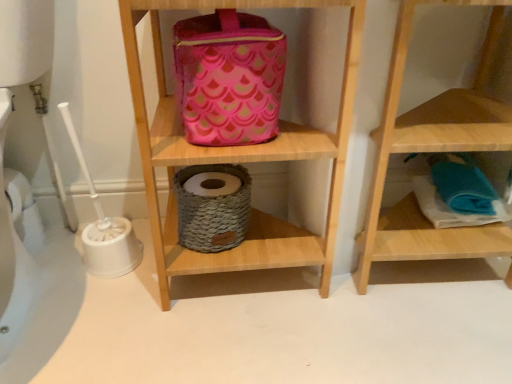
Question: Is wooden towel at lower right, the second shelf from the left, a part of pink fabric pouch at upper center?

Choices:
 (A) no
 (B) yes

Answer: (A)

Question: Is pink fabric pouch at upper center far from wooden towel at lower right, the second shelf from the left?

Choices:
 (A) no
 (B) yes

Answer: (A)

Question: Is pink fabric pouch at upper center positioned behind wooden towel at lower right, acting as the first shelf starting from the right?

Choices:
 (A) yes
 (B) no

Answer: (A)

Question: Is pink fabric pouch at upper center placed right next to wooden towel at lower right, the second shelf from the left?

Choices:
 (A) yes
 (B) no

Answer: (B)

Question: From a real-world perspective, does pink fabric pouch at upper center sit lower than wooden towel at lower right, the second shelf from the left?

Choices:
 (A) no
 (B) yes

Answer: (A)

Question: From the image's perspective, is pink fabric pouch at upper center below wooden towel at lower right, the second shelf from the left?

Choices:
 (A) no
 (B) yes

Answer: (A)

Question: Considering the relative sizes of pink fabric bag at upper center, arranged as the 1th shelf when viewed from the left, and pink fabric pouch at upper center in the image provided, is pink fabric bag at upper center, arranged as the 1th shelf when viewed from the left, bigger than pink fabric pouch at upper center?

Choices:
 (A) no
 (B) yes

Answer: (B)

Question: From a real-world perspective, is pink fabric bag at upper center, the 2th shelf viewed from the right, on top of pink fabric pouch at upper center?

Choices:
 (A) yes
 (B) no

Answer: (B)

Question: Considering the relative positions of pink fabric bag at upper center, arranged as the 1th shelf when viewed from the left, and pink fabric pouch at upper center in the image provided, is pink fabric bag at upper center, arranged as the 1th shelf when viewed from the left, to the left of pink fabric pouch at upper center from the viewer's perspective?

Choices:
 (A) no
 (B) yes

Answer: (A)

Question: Is the depth of pink fabric bag at upper center, arranged as the 1th shelf when viewed from the left, greater than that of pink fabric pouch at upper center?

Choices:
 (A) yes
 (B) no

Answer: (B)

Question: Is pink fabric bag at upper center, the 2th shelf viewed from the right, looking in the opposite direction of pink fabric pouch at upper center?

Choices:
 (A) yes
 (B) no

Answer: (A)

Question: Can you confirm if pink fabric bag at upper center, the 2th shelf viewed from the right, is positioned to the right of pink fabric pouch at upper center?

Choices:
 (A) no
 (B) yes

Answer: (B)

Question: Considering the relative positions of pink fabric pouch at upper center and pink fabric bag at upper center, the 2th shelf viewed from the right, in the image provided, is pink fabric pouch at upper center behind pink fabric bag at upper center, the 2th shelf viewed from the right,?

Choices:
 (A) yes
 (B) no

Answer: (A)